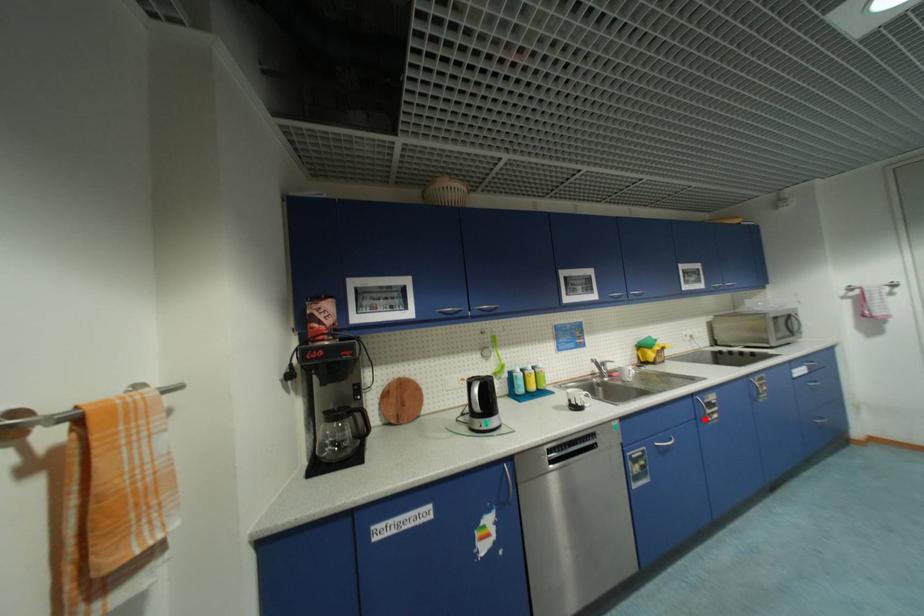
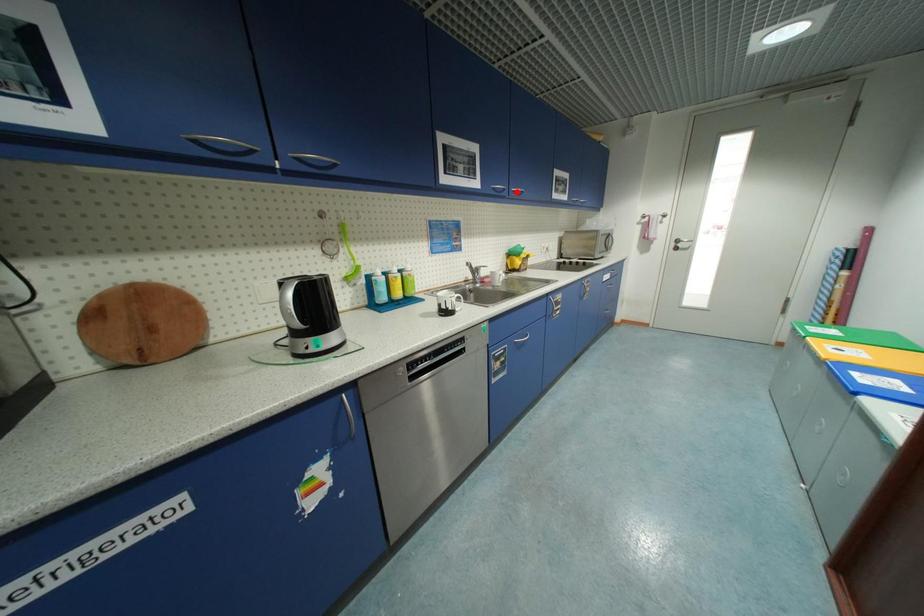
I am providing you with two images of the same scene from different viewpoints. A red point is marked on the first image and another point is marked on the second image. Does the point marked in image1 correspond to the same location as the one in image2?

No